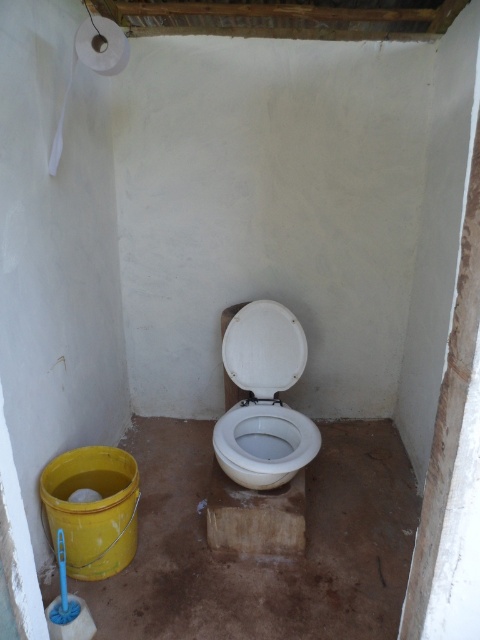
Question: Which point is closer to the camera?

Choices:
 (A) white matte toilet paper at upper left
 (B) white glossy toilet bowl at center

Answer: (A)

Question: Does white glossy toilet bowl at center appear on the right side of white matte toilet paper at upper left?

Choices:
 (A) no
 (B) yes

Answer: (B)

Question: Is the position of white glossy toilet bowl at center less distant than that of white matte toilet paper at upper left?

Choices:
 (A) yes
 (B) no

Answer: (B)

Question: Can you confirm if white glossy toilet bowl at center is positioned above white matte toilet paper at upper left?

Choices:
 (A) no
 (B) yes

Answer: (A)

Question: Which point is closer to the camera taking this photo?

Choices:
 (A) (297, 433)
 (B) (87, 22)

Answer: (B)